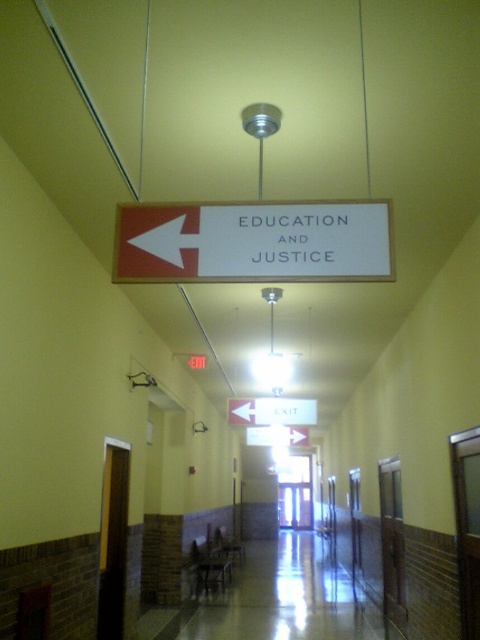
Question: Is white matte sign at center bigger than white matte arrow at upper left?

Choices:
 (A) no
 (B) yes

Answer: (B)

Question: Does white matte sign at center appear on the left side of white matte arrow at upper left?

Choices:
 (A) no
 (B) yes

Answer: (A)

Question: Which point appears farthest from the camera in this image?

Choices:
 (A) (340, 212)
 (B) (180, 256)

Answer: (A)

Question: Is white matte sign at center smaller than white matte arrow at upper left?

Choices:
 (A) yes
 (B) no

Answer: (B)